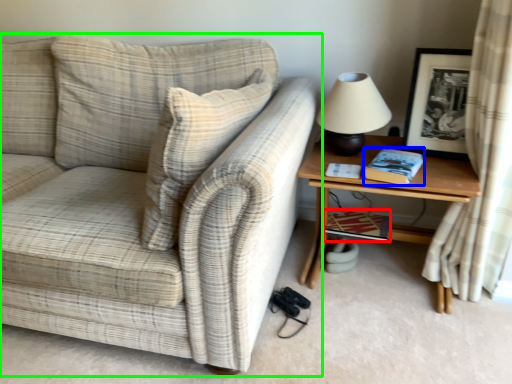
Question: Which object is the farthest from book (highlighted by a red box)? Choose among these: book (highlighted by a blue box) or studio couch (highlighted by a green box).

Choices:
 (A) book
 (B) studio couch

Answer: (B)